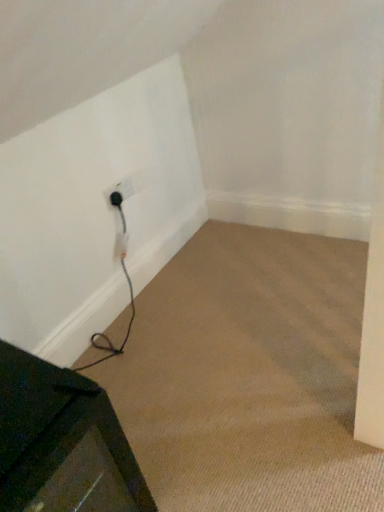
Question: Does metallic dark green table at lower left appear on the right side of black rubber plug at lower left?

Choices:
 (A) yes
 (B) no

Answer: (B)

Question: Can you confirm if metallic dark green table at lower left is taller than black rubber plug at lower left?

Choices:
 (A) yes
 (B) no

Answer: (A)

Question: Is metallic dark green table at lower left positioned beyond the bounds of black rubber plug at lower left?

Choices:
 (A) yes
 (B) no

Answer: (A)

Question: From a real-world perspective, is metallic dark green table at lower left located beneath black rubber plug at lower left?

Choices:
 (A) yes
 (B) no

Answer: (A)

Question: Is metallic dark green table at lower left shorter than black rubber plug at lower left?

Choices:
 (A) no
 (B) yes

Answer: (A)

Question: From the image's perspective, is black rubber plug at lower left above or below metallic dark green table at lower left?

Choices:
 (A) above
 (B) below

Answer: (A)

Question: Is black rubber plug at lower left bigger or smaller than metallic dark green table at lower left?

Choices:
 (A) small
 (B) big

Answer: (A)

Question: In terms of height, does black rubber plug at lower left look taller or shorter compared to metallic dark green table at lower left?

Choices:
 (A) short
 (B) tall

Answer: (A)

Question: In terms of width, does black rubber plug at lower left look wider or thinner when compared to metallic dark green table at lower left?

Choices:
 (A) thin
 (B) wide

Answer: (A)

Question: From a real-world perspective, is black rubber plug at lower left physically located above or below black plastic outlet at lower left?

Choices:
 (A) below
 (B) above

Answer: (B)

Question: Relative to black plastic outlet at lower left, is black rubber plug at lower left in front or behind?

Choices:
 (A) front
 (B) behind

Answer: (B)

Question: Considering the positions of black rubber plug at lower left and black plastic outlet at lower left in the image, is black rubber plug at lower left taller or shorter than black plastic outlet at lower left?

Choices:
 (A) tall
 (B) short

Answer: (B)

Question: Looking at their shapes, would you say black rubber plug at lower left is wider or thinner than black plastic outlet at lower left?

Choices:
 (A) wide
 (B) thin

Answer: (B)

Question: Considering the positions of black plastic outlet at lower left and black rubber plug at lower left in the image, is black plastic outlet at lower left bigger or smaller than black rubber plug at lower left?

Choices:
 (A) big
 (B) small

Answer: (A)

Question: From the image's perspective, is black plastic outlet at lower left positioned above or below black rubber plug at lower left?

Choices:
 (A) below
 (B) above

Answer: (A)